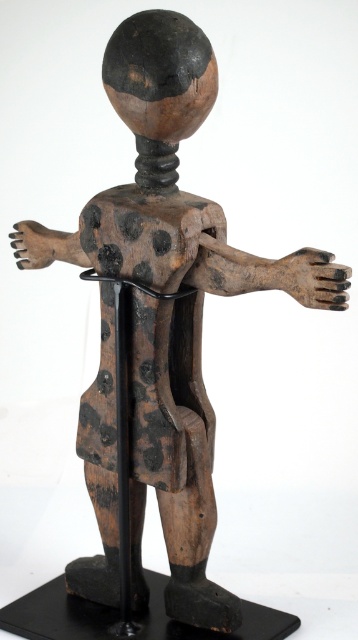
Question: Is black wood pole at center closer to the viewer compared to brown wood hand at left?

Choices:
 (A) no
 (B) yes

Answer: (B)

Question: Which of the following is the closest to the observer?

Choices:
 (A) (126, 300)
 (B) (26, 237)
 (C) (292, 278)

Answer: (C)

Question: Can you confirm if dark brown wood hand at right is positioned below brown wood hand at left?

Choices:
 (A) no
 (B) yes

Answer: (B)

Question: Which of the following is the closest to the observer?

Choices:
 (A) black wood pole at center
 (B) brown wood hand at left

Answer: (A)

Question: Which point is closer to the camera?

Choices:
 (A) dark brown wood hand at right
 (B) brown wood hand at left
 (C) black wood pole at center

Answer: (A)

Question: Can you confirm if black wood pole at center is positioned above dark brown wood hand at right?

Choices:
 (A) no
 (B) yes

Answer: (A)